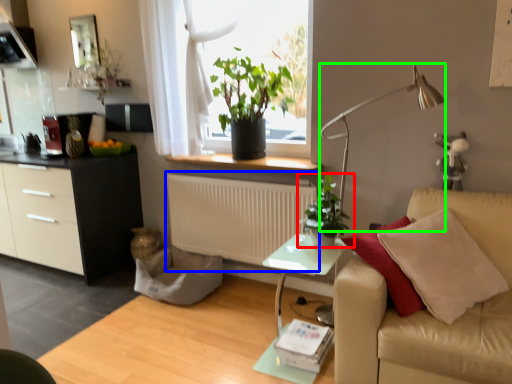
Question: Which object is the closest to the houseplant (highlighted by a red box)? Choose among these: radiator (highlighted by a blue box) or lamp (highlighted by a green box).

Choices:
 (A) radiator
 (B) lamp

Answer: (B)